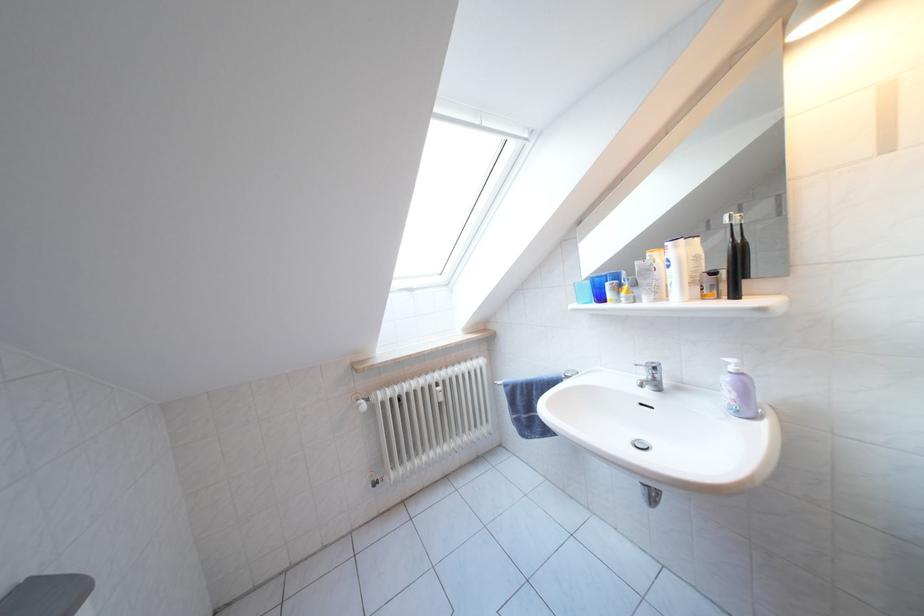
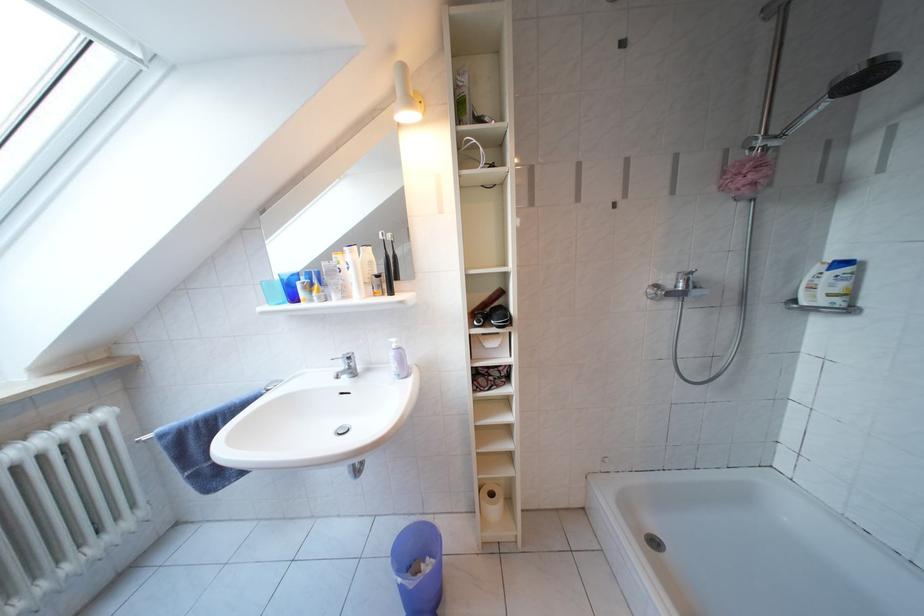
Where in the second image is the point corresponding to point 722,278 from the first image?

(386, 281)